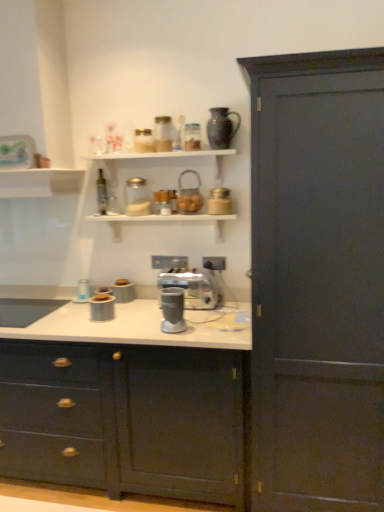
Measure the distance between matte dark wood cabinet at right, the 2th cabinetry positioned from the left, and camera.

The distance of matte dark wood cabinet at right, the 2th cabinetry positioned from the left, from camera is 1.61 meters.

Where is `clear glass jar at upper center, the 4th appliance positioned from the bottom`? The width and height of the screenshot is (384, 512). clear glass jar at upper center, the 4th appliance positioned from the bottom is located at coordinates (137, 197).

What do you see at coordinates (193, 287) in the screenshot?
I see `metallic silver blender at center` at bounding box center [193, 287].

What do you see at coordinates (172, 310) in the screenshot? The height and width of the screenshot is (512, 384). I see `satin silver coffee machine at center` at bounding box center [172, 310].

Identify the location of matte dark blue cabinet at center, positioned as the 2th cabinetry in right-to-left order. The image size is (384, 512). (124, 419).

In order to face matte dark blue cabinet at center, arranged as the 1th cabinetry when viewed from the left, should I rotate leftwards or rightwards?

Turn left approximately 12.823 degrees to face it.

This screenshot has height=512, width=384. In order to click on matte glass jar at center, which ranks as the 3th appliance in bottom-to-top order in this screenshot , I will do `click(219, 202)`.

Considering the relative sizes of white matte shelf at upper center and matte ceramic canister at center, positioned as the 2th appliance in bottom-to-top order, in the image provided, is white matte shelf at upper center taller than matte ceramic canister at center, positioned as the 2th appliance in bottom-to-top order,?

Incorrect, the height of white matte shelf at upper center is not larger of that of matte ceramic canister at center, positioned as the 2th appliance in bottom-to-top order.

Between white matte shelf at upper center and matte ceramic canister at center, the fourth appliance positioned from the right, which one appears on the right side from the viewer's perspective?

Positioned to the right is matte ceramic canister at center, the fourth appliance positioned from the right.

From the image's perspective, which one is positioned higher, white matte shelf at upper center or matte ceramic canister at center, the fourth appliance positioned from the right?

From the image's view, white matte shelf at upper center is above.

Find the location of a particular element. shelf located above the matte ceramic canister at center, positioned as the 2th appliance in bottom-to-top order (from the image's perspective) is located at coordinates (40, 182).

Is satin silver coffee machine at center at the back of metallic silver blender at center?

No, metallic silver blender at center is not facing the opposite direction of satin silver coffee machine at center.

From the picture: From a real-world perspective, who is located lower, metallic silver blender at center or satin silver coffee machine at center?

From a 3D spatial view, satin silver coffee machine at center is below.

Visually, is metallic silver blender at center positioned to the left or to the right of satin silver coffee machine at center?

In the image, metallic silver blender at center appears on the right side of satin silver coffee machine at center.

Consider the image. Is metallic silver blender at center directly adjacent to satin silver coffee machine at center?

No.

From the image's perspective, who appears lower, matte plastic container at center, acting as the 1th appliance starting from the bottom, or metallic silver blender at center?

From the image's view, matte plastic container at center, acting as the 1th appliance starting from the bottom, is below.

There is a metallic silver blender at center. Where is `the 1st appliance below it (from a real-world perspective)`? This screenshot has height=512, width=384. the 1st appliance below it (from a real-world perspective) is located at coordinates (102, 307).

Is matte plastic container at center, placed as the first appliance when sorted from left to right, positioned beyond the bounds of metallic silver blender at center?

matte plastic container at center, placed as the first appliance when sorted from left to right, is positioned outside metallic silver blender at center.

Is point (106, 303) closer or farther from the camera than point (185, 298)?

Point (106, 303) is positioned closer to the camera compared to point (185, 298).

Is matte glass jar at center, the fifth appliance positioned from the left, positioned beyond the bounds of white matte shelf at upper center?

Yes, matte glass jar at center, the fifth appliance positioned from the left, is not within white matte shelf at upper center.

Which object is positioned more to the left, matte glass jar at center, the fifth appliance positioned from the left, or white matte shelf at upper center?

Positioned to the left is white matte shelf at upper center.

In the scene shown: How different are the orientations of matte glass jar at center, which appears as the first appliance when viewed from the right, and white matte shelf at upper center in degrees?

matte glass jar at center, which appears as the first appliance when viewed from the right, and white matte shelf at upper center are facing 0.223 degrees away from each other.

Is matte glass jar at center, which ranks as the 3th appliance in bottom-to-top order, bigger or smaller than white matte shelf at upper center?

matte glass jar at center, which ranks as the 3th appliance in bottom-to-top order, is smaller than white matte shelf at upper center.

From the image's perspective, which is above, matte dark wood cabinet at right, marked as the 1th cabinetry in a right-to-left arrangement, or matte ceramic canister at center, positioned as the 2th appliance in bottom-to-top order?

From the image's view, matte dark wood cabinet at right, marked as the 1th cabinetry in a right-to-left arrangement, is above.

Can you tell me how much matte dark wood cabinet at right, the 2th cabinetry positioned from the left, and matte ceramic canister at center, marked as the 4th appliance in a top-to-bottom arrangement, differ in facing direction?

matte dark wood cabinet at right, the 2th cabinetry positioned from the left, and matte ceramic canister at center, marked as the 4th appliance in a top-to-bottom arrangement, are facing 0.121 degrees away from each other.

Are matte dark wood cabinet at right, the 2th cabinetry positioned from the left, and matte ceramic canister at center, marked as the 4th appliance in a top-to-bottom arrangement, located far from each other?

Yes, matte dark wood cabinet at right, the 2th cabinetry positioned from the left, and matte ceramic canister at center, marked as the 4th appliance in a top-to-bottom arrangement, are quite far apart.

Which of these two, matte dark wood cabinet at right, the 2th cabinetry positioned from the left, or matte ceramic canister at center, marked as the 4th appliance in a top-to-bottom arrangement, is thinner?

Thinner between the two is matte ceramic canister at center, marked as the 4th appliance in a top-to-bottom arrangement.

From a real-world perspective, which is physically below, matte ceramic canister at center, positioned as the 2th appliance in bottom-to-top order, or matte dark wood cabinet at right, marked as the 1th cabinetry in a right-to-left arrangement?

matte ceramic canister at center, positioned as the 2th appliance in bottom-to-top order, from a real-world perspective.

Consider the image. Is matte ceramic canister at center, marked as the 4th appliance in a top-to-bottom arrangement, behind matte dark wood cabinet at right, the 2th cabinetry positioned from the left?

Yes.

Where is `the 4th appliance to the left of the matte dark wood cabinet at right, marked as the 1th cabinetry in a right-to-left arrangement, counting from the anchor's position`? The height and width of the screenshot is (512, 384). the 4th appliance to the left of the matte dark wood cabinet at right, marked as the 1th cabinetry in a right-to-left arrangement, counting from the anchor's position is located at coordinates (123, 291).

Is matte ceramic canister at center, positioned as the 2th appliance in bottom-to-top order, taller than matte dark wood cabinet at right, the 2th cabinetry positioned from the left?

No, matte ceramic canister at center, positioned as the 2th appliance in bottom-to-top order, is not taller than matte dark wood cabinet at right, the 2th cabinetry positioned from the left.

Which object is thinner, matte dark blue cabinet at center, positioned as the 2th cabinetry in right-to-left order, or translucent glass basket at upper center, positioned as the 1th appliance in top-to-bottom order?

Thinner between the two is translucent glass basket at upper center, positioned as the 1th appliance in top-to-bottom order.

Between matte dark blue cabinet at center, arranged as the 1th cabinetry when viewed from the left, and translucent glass basket at upper center, acting as the fifth appliance starting from the bottom, which one appears on the left side from the viewer's perspective?

Positioned to the left is matte dark blue cabinet at center, arranged as the 1th cabinetry when viewed from the left.

Is matte dark blue cabinet at center, arranged as the 1th cabinetry when viewed from the left, far from translucent glass basket at upper center, positioned as the 2th appliance in right-to-left order?

Yes, matte dark blue cabinet at center, arranged as the 1th cabinetry when viewed from the left, and translucent glass basket at upper center, positioned as the 2th appliance in right-to-left order, are quite far apart.

Image resolution: width=384 pixels, height=512 pixels. I want to click on cabinetry on the left of the translucent glass basket at upper center, acting as the fifth appliance starting from the bottom, so click(124, 419).

From the white matte shelf at upper center, count 3rd appliances backward and point to it. Please provide its 2D coordinates.

[(123, 291)]

The image size is (384, 512). In the image, there is a metallic silver blender at center. Identify the location of coffee machine below it (from a real-world perspective). (172, 310).

Based on their spatial positions, is translucent glass basket at upper center, acting as the fifth appliance starting from the bottom, or matte dark wood cabinet at right, marked as the 1th cabinetry in a right-to-left arrangement, further from clear glass bottle at upper center?

matte dark wood cabinet at right, marked as the 1th cabinetry in a right-to-left arrangement, is further to clear glass bottle at upper center.

Which object lies further to the anchor point clear glass bottle at upper center, matte glass jar at center, which appears as the first appliance when viewed from the right, or matte black vase at upper center?

Based on the image, matte black vase at upper center appears to be further to clear glass bottle at upper center.

When comparing their distances from matte black vase at upper center, does translucent glass basket at upper center, positioned as the fourth appliance in left-to-right order, or white matte shelf at upper center seem closer?

Based on the image, translucent glass basket at upper center, positioned as the fourth appliance in left-to-right order, appears to be nearer to matte black vase at upper center.

Which object lies further to the anchor point white matte shelf at upper center, metallic silver blender at center or translucent glass basket at upper center, positioned as the fourth appliance in left-to-right order?

metallic silver blender at center is further to white matte shelf at upper center.

From the image, which object appears to be nearer to white matte shelf at upper center, clear glass jar at upper center, the 2th appliance when ordered from top to bottom, or matte dark blue cabinet at center, arranged as the 1th cabinetry when viewed from the left?

The object closer to white matte shelf at upper center is clear glass jar at upper center, the 2th appliance when ordered from top to bottom.

Which object lies further to the anchor point matte dark wood cabinet at right, marked as the 1th cabinetry in a right-to-left arrangement, satin silver coffee machine at center or white matte shelf at upper center?

white matte shelf at upper center is positioned further to the anchor matte dark wood cabinet at right, marked as the 1th cabinetry in a right-to-left arrangement.

When comparing their distances from clear glass bottle at upper center, does satin silver coffee machine at center or clear glass jar at upper center, the 2th appliance when ordered from top to bottom, seem further?

satin silver coffee machine at center is positioned further to the anchor clear glass bottle at upper center.

Estimate the real-world distances between objects in this image. Which object is closer to matte plastic container at center, placed as the first appliance when sorted from left to right, metallic silver blender at center or matte black vase at upper center?

metallic silver blender at center is positioned closer to the anchor matte plastic container at center, placed as the first appliance when sorted from left to right.

The image size is (384, 512). I want to click on cabinetry between matte black vase at upper center and matte dark blue cabinet at center, arranged as the 1th cabinetry when viewed from the left, vertically, so click(x=317, y=281).

Identify the location of coffee machine positioned between matte dark wood cabinet at right, marked as the 1th cabinetry in a right-to-left arrangement, and metallic silver blender at center from near to far. This screenshot has height=512, width=384. (172, 310).

I want to click on shelf between matte black vase at upper center and matte dark blue cabinet at center, arranged as the 1th cabinetry when viewed from the left, in the vertical direction, so click(40, 182).

In order to click on coffeepot between matte dark wood cabinet at right, marked as the 1th cabinetry in a right-to-left arrangement, and translucent glass basket at upper center, positioned as the 1th appliance in top-to-bottom order, along the z-axis in this screenshot , I will do `click(221, 128)`.